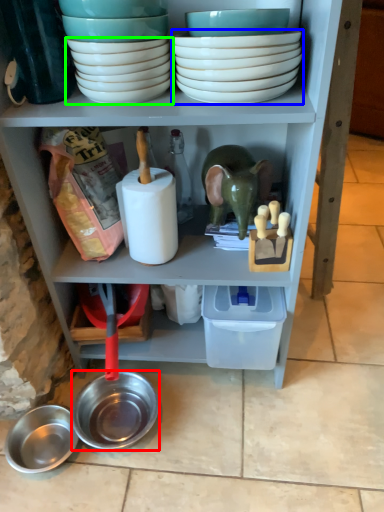
Question: Which object is positioned farthest from bowl (highlighted by a red box)? Select from bowl (highlighted by a blue box) and bowl (highlighted by a green box).

Choices:
 (A) bowl
 (B) bowl

Answer: (A)